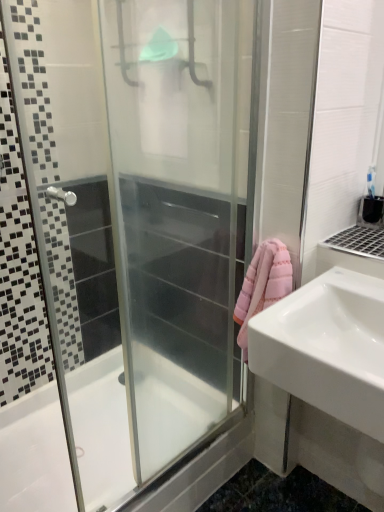
What is the approximate width of white glossy bathtub at lower left?

The width of white glossy bathtub at lower left is 28.30 inches.

In order to face transparent glass shower door at center, should I rotate leftwards or rightwards?

It's best to rotate left around 7.430 degrees.

The height and width of the screenshot is (512, 384). I want to click on white glossy bathtub at lower left, so click(x=35, y=455).

Which is correct: white glossy sink at right is inside transparent glass shower door at center, or outside of it?

white glossy sink at right is not inside transparent glass shower door at center, it's outside.

From a real-world perspective, is white glossy sink at right under transparent glass shower door at center?

Yes, from a real-world perspective, white glossy sink at right is beneath transparent glass shower door at center.

Which is nearer, (293, 380) or (183, 411)?

Clearly, point (293, 380) is closer to the camera than point (183, 411).

Which object is thinner, white glossy bathtub at lower left or white glossy sink at right?

With smaller width is white glossy sink at right.

Considering the positions of objects white glossy bathtub at lower left and white glossy sink at right in the image provided, who is more to the left, white glossy bathtub at lower left or white glossy sink at right?

Positioned to the left is white glossy bathtub at lower left.

Considering the sizes of objects white glossy bathtub at lower left and white glossy sink at right in the image provided, who is shorter, white glossy bathtub at lower left or white glossy sink at right?

white glossy bathtub at lower left.

From a real-world perspective, does white glossy bathtub at lower left stand above transparent glass shower door at center?

Actually, white glossy bathtub at lower left is physically below transparent glass shower door at center in the real world.

Is the depth of white glossy bathtub at lower left greater than that of transparent glass shower door at center?

Yes, the depth of white glossy bathtub at lower left is greater than that of transparent glass shower door at center.

Is point (78, 461) closer to camera compared to point (145, 87)?

Yes, it is.

From the picture: Can you confirm if white glossy bathtub at lower left is taller than transparent glass shower door at center?

In fact, white glossy bathtub at lower left may be shorter than transparent glass shower door at center.

Where is `bathtub below the white glossy sink at right (from a real-world perspective)`? This screenshot has height=512, width=384. bathtub below the white glossy sink at right (from a real-world perspective) is located at coordinates (35, 455).

Between point (337, 275) and point (26, 463), which one is positioned behind?

Positioned behind is point (26, 463).

Considering the positions of objects white glossy sink at right and white glossy bathtub at lower left in the image provided, who is in front, white glossy sink at right or white glossy bathtub at lower left?

white glossy sink at right.

Is transparent glass shower door at center oriented towards white glossy bathtub at lower left?

No, transparent glass shower door at center does not turn towards white glossy bathtub at lower left.

In terms of size, does transparent glass shower door at center appear bigger or smaller than white glossy bathtub at lower left?

Clearly, transparent glass shower door at center is smaller in size than white glossy bathtub at lower left.

How different are the orientations of transparent glass shower door at center and white glossy bathtub at lower left in degrees?

The angular difference between transparent glass shower door at center and white glossy bathtub at lower left is 1.91 degrees.

Which of these two, transparent glass shower door at center or white glossy sink at right, is thinner?

transparent glass shower door at center is thinner.

Do you think transparent glass shower door at center is within white glossy sink at right, or outside of it?

transparent glass shower door at center is located beyond the bounds of white glossy sink at right.

Is transparent glass shower door at center not near white glossy sink at right?

No.

Considering the sizes of objects transparent glass shower door at center and white glossy sink at right in the image provided, who is taller, transparent glass shower door at center or white glossy sink at right?

transparent glass shower door at center.

In order to click on sink below the transparent glass shower door at center (from a real-world perspective) in this screenshot , I will do `click(327, 347)`.

Locate an element on the screen. bathtub behind the white glossy sink at right is located at coordinates (35, 455).

Consider the image. Which object lies further to the anchor point transparent glass shower door at center, white glossy sink at right or white glossy bathtub at lower left?

white glossy bathtub at lower left.

Estimate the real-world distances between objects in this image. Which object is further from white glossy bathtub at lower left, transparent glass shower door at center or white glossy sink at right?

The object further to white glossy bathtub at lower left is white glossy sink at right.

Looking at this image, estimate the real-world distances between objects in this image. Which object is closer to white glossy sink at right, transparent glass shower door at center or white glossy bathtub at lower left?

Among the two, transparent glass shower door at center is located nearer to white glossy sink at right.

Estimate the real-world distances between objects in this image. Which object is closer to white glossy sink at right, white glossy bathtub at lower left or transparent glass shower door at center?

transparent glass shower door at center is closer to white glossy sink at right.

Looking at the image, which one is located further to white glossy bathtub at lower left, white glossy sink at right or transparent glass shower door at center?

Based on the image, white glossy sink at right appears to be further to white glossy bathtub at lower left.

From the image, which object appears to be nearer to transparent glass shower door at center, white glossy bathtub at lower left or white glossy sink at right?

white glossy sink at right.

Locate an element on the screen. The image size is (384, 512). screen door between white glossy bathtub at lower left and white glossy sink at right in the horizontal direction is located at coordinates (178, 210).